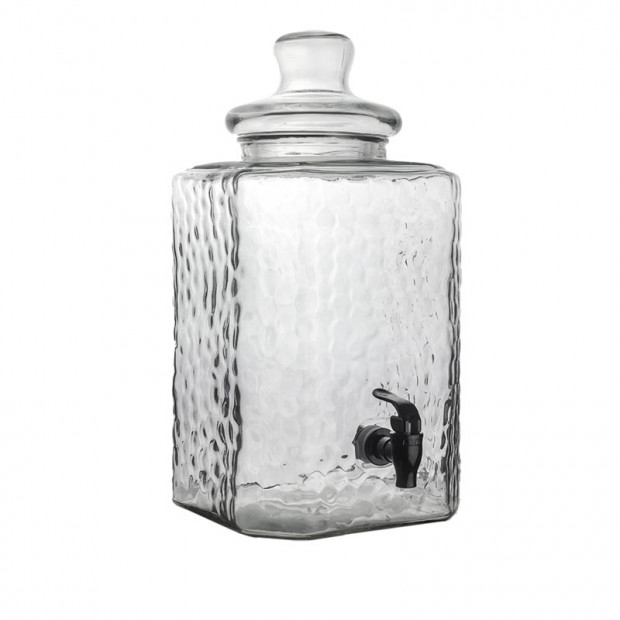
You are a GUI agent. You are given a task and a screenshot of the screen. Output one action in this format:
    pyautogui.click(x=<x>, y=<y>)
    Task: Click on the glass stopper
    This screenshot has height=620, width=620.
    Given the screenshot: What is the action you would take?
    pyautogui.click(x=311, y=59)